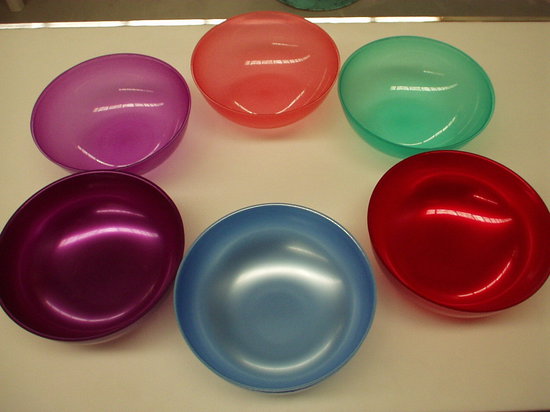
Image resolution: width=550 pixels, height=412 pixels. I want to click on blue bowl, so click(x=324, y=244).